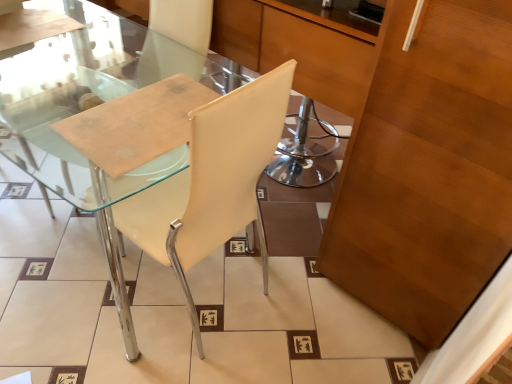
Locate an element on the screen. Image resolution: width=512 pixels, height=384 pixels. transparent glass table at left is located at coordinates [89, 92].

The width and height of the screenshot is (512, 384). What do you see at coordinates (212, 181) in the screenshot? I see `white leather chair at center` at bounding box center [212, 181].

Identify the location of wooden cabinet at right. Image resolution: width=512 pixels, height=384 pixels. (428, 169).

In the scene shown: Who is taller, white leather chair at center or transparent glass table at left?

transparent glass table at left is taller.

Considering the sizes of objects white leather chair at center and transparent glass table at left in the image provided, who is smaller, white leather chair at center or transparent glass table at left?

white leather chair at center is smaller.

From the image's perspective, relative to transparent glass table at left, is white leather chair at center above or below?

Based on their image positions, white leather chair at center is located beneath transparent glass table at left.

Is white leather chair at center to the right of transparent glass table at left from the viewer's perspective?

Indeed, white leather chair at center is positioned on the right side of transparent glass table at left.

Relative to white leather chair at center, is transparent glass table at left in front or behind?

transparent glass table at left is behind white leather chair at center.

Looking at this image, is transparent glass table at left turned away from white leather chair at center?

That's not correct — transparent glass table at left is not looking away from white leather chair at center.

Which object is thinner, transparent glass table at left or white leather chair at center?

transparent glass table at left.

Which of these two, wooden cabinet at right or transparent glass table at left, stands taller?

Standing taller between the two is wooden cabinet at right.

From the image's perspective, which is below, wooden cabinet at right or transparent glass table at left?

wooden cabinet at right is shown below in the image.

From a real-world perspective, is wooden cabinet at right positioned over transparent glass table at left based on gravity?

Yes.

Is point (442, 295) closer to viewer compared to point (5, 76)?

Yes, it is in front of point (5, 76).

Is wooden cabinet at right outside of white leather chair at center?

Absolutely, wooden cabinet at right is external to white leather chair at center.

Is wooden cabinet at right oriented away from white leather chair at center?

No, wooden cabinet at right is not facing away from white leather chair at center.

Find the location of `chair below the wooden cabinet at right (from a real-world perspective)`. chair below the wooden cabinet at right (from a real-world perspective) is located at coordinates (212, 181).

Is wooden cabinet at right in contact with white leather chair at center?

No, wooden cabinet at right is not making contact with white leather chair at center.

From a real-world perspective, which is physically above, white leather chair at center or wooden cabinet at right?

wooden cabinet at right is physically above.

Is point (180, 248) farther from viewer compared to point (470, 295)?

No.

From the image's perspective, between white leather chair at center and wooden cabinet at right, which one is located above?

wooden cabinet at right is shown above in the image.

Is white leather chair at center oriented away from wooden cabinet at right?

No, wooden cabinet at right is not at the back of white leather chair at center.

You are a GUI agent. You are given a task and a screenshot of the screen. Output one action in this format:
    pyautogui.click(x=<x>, y=<y>)
    Task: Click on the glass table behind the wooden cabinet at right
    
    Given the screenshot: What is the action you would take?
    pyautogui.click(x=89, y=92)

Is transparent glass table at left further to camera compared to wooden cabinet at right?

Yes, the depth of transparent glass table at left is greater than that of wooden cabinet at right.

Does transparent glass table at left have a larger size compared to wooden cabinet at right?

No.

From a real-world perspective, which is physically below, transparent glass table at left or wooden cabinet at right?

In real-world perspective, transparent glass table at left is lower.

In order to click on glass table above the white leather chair at center (from a real-world perspective) in this screenshot , I will do `click(89, 92)`.

Identify the location of glass table that is behind the white leather chair at center. (89, 92).

In the scene shown: When comparing their distances from white leather chair at center, does wooden cabinet at right or transparent glass table at left seem further?

Among the two, transparent glass table at left is located further to white leather chair at center.

Looking at the image, which one is located further to transparent glass table at left, wooden cabinet at right or white leather chair at center?

wooden cabinet at right lies further to transparent glass table at left than the other object.

When comparing their distances from transparent glass table at left, does white leather chair at center or wooden cabinet at right seem further?

The object further to transparent glass table at left is wooden cabinet at right.

Which object lies nearer to the anchor point wooden cabinet at right, transparent glass table at left or white leather chair at center?

The object closer to wooden cabinet at right is white leather chair at center.

Based on their spatial positions, is white leather chair at center or transparent glass table at left closer to wooden cabinet at right?

white leather chair at center is closer to wooden cabinet at right.

From the image, which object appears to be nearer to white leather chair at center, transparent glass table at left or wooden cabinet at right?

The object closer to white leather chair at center is wooden cabinet at right.

Where is `chair between transparent glass table at left and wooden cabinet at right in the horizontal direction`? chair between transparent glass table at left and wooden cabinet at right in the horizontal direction is located at coordinates (212, 181).